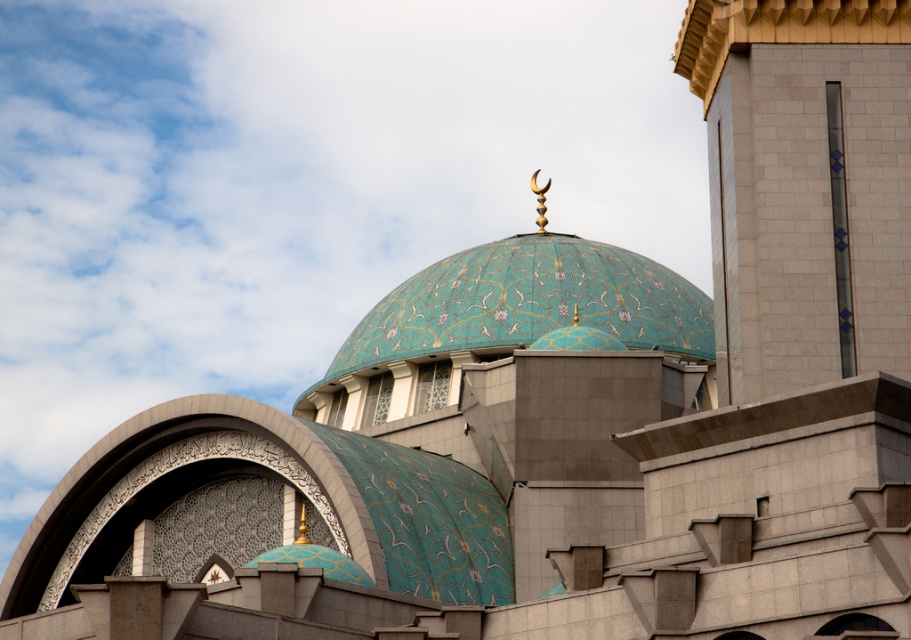
Question: Which point is closer to the camera?

Choices:
 (A) (498, 291)
 (B) (787, 362)

Answer: (B)

Question: Can you confirm if smooth beige tower at upper right is positioned below teal mosaic dome at center?

Choices:
 (A) yes
 (B) no

Answer: (B)

Question: Which of the following is the farthest from the observer?

Choices:
 (A) (904, 102)
 (B) (495, 260)

Answer: (B)

Question: Is smooth beige tower at upper right to the left of teal mosaic dome at center from the viewer's perspective?

Choices:
 (A) yes
 (B) no

Answer: (B)

Question: Is smooth beige tower at upper right smaller than teal mosaic dome at center?

Choices:
 (A) no
 (B) yes

Answer: (B)

Question: Which object appears closest to the camera in this image?

Choices:
 (A) smooth beige tower at upper right
 (B) teal mosaic dome at center

Answer: (A)